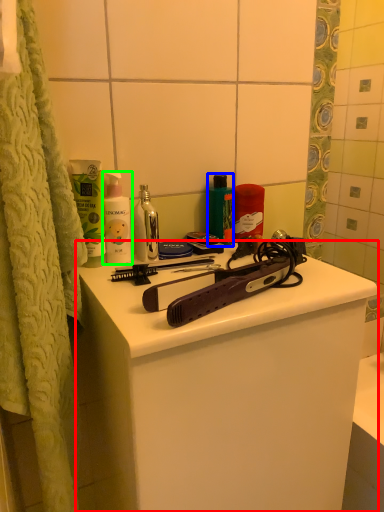
Question: Based on their relative distances, which object is farther from bathroom cabinet (highlighted by a red box)? Choose from mouthwash (highlighted by a blue box) and cleaning product (highlighted by a green box).

Choices:
 (A) mouthwash
 (B) cleaning product

Answer: (A)